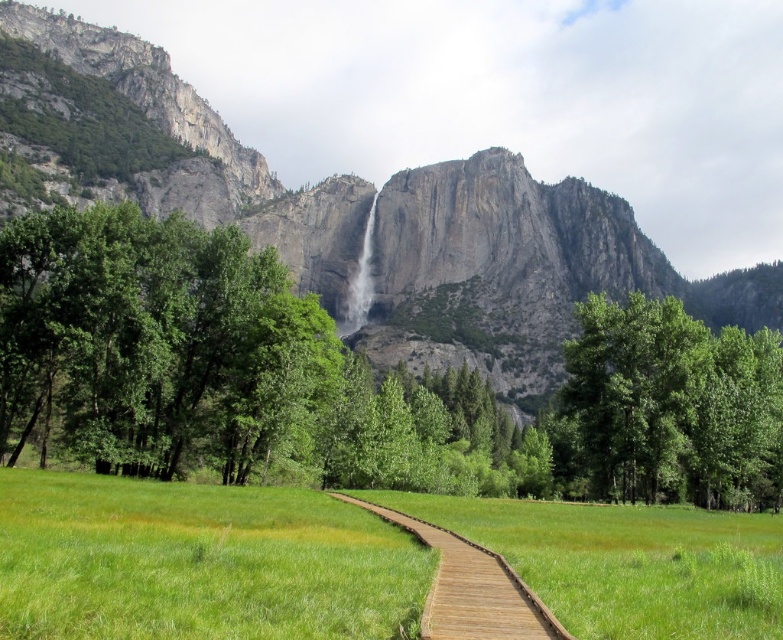
Can you confirm if gray rock cliff at upper center is taller than green leafy tree at center-right?

Indeed, gray rock cliff at upper center has a greater height compared to green leafy tree at center-right.

In order to click on gray rock cliff at upper center in this screenshot , I will do `click(520, 269)`.

Is green leafy tree at center-right below wooden boardwalk at center?

No.

Does point (666, 426) come in front of point (455, 536)?

No, it is behind (455, 536).

Is point (769, 392) positioned in front of point (421, 632)?

No, it is not.

Identify the location of green leafy tree at center-right. (669, 406).

Between green grass at center and white textured waterfall at center, which one appears on the left side from the viewer's perspective?

white textured waterfall at center

Does green grass at center appear on the left side of white textured waterfall at center?

In fact, green grass at center is to the right of white textured waterfall at center.

Between point (258, 488) and point (358, 321), which one is positioned in front?

Point (258, 488) is more forward.

Image resolution: width=783 pixels, height=640 pixels. I want to click on green grass at center, so click(x=197, y=561).